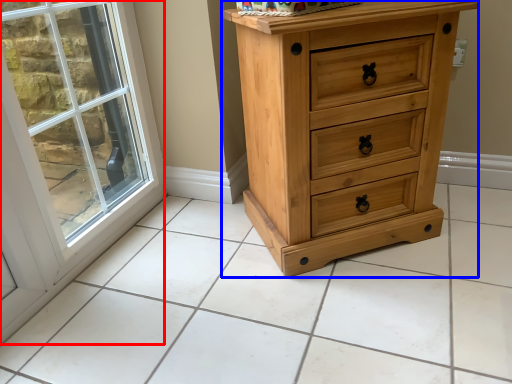
Question: Which point is further to the camera, window (highlighted by a red box) or chest of drawers (highlighted by a blue box)?

Choices:
 (A) window
 (B) chest of drawers

Answer: (B)